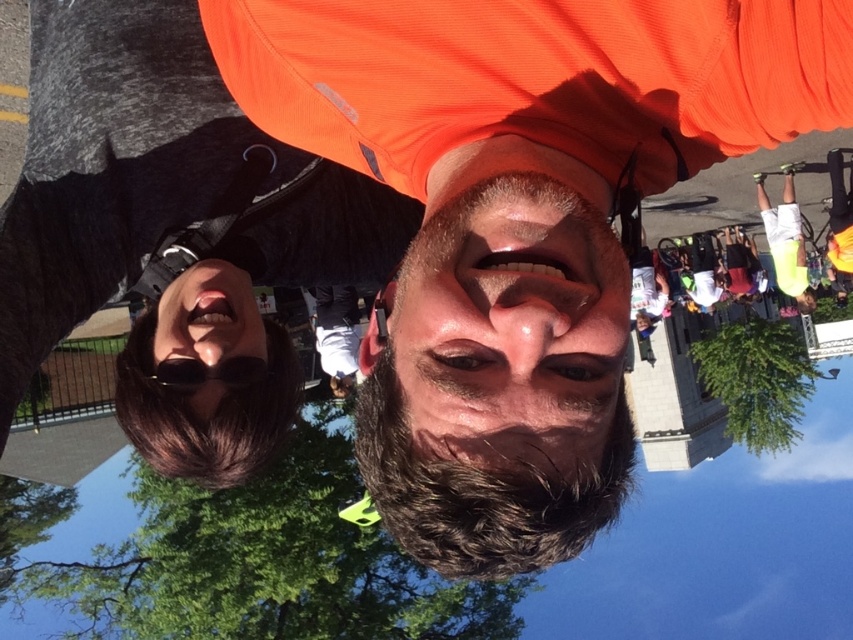
You are a photographer reviewing a photo and notice two objects in the image. The first is a brown matte beard at center, and the second is a black matte sunglasses at lower left. Based on their positions, which object is located to the right of the other?

The brown matte beard at center is positioned on the right side of black matte sunglasses at lower left.

You are a photographer trying to capture a closeup shot of the brown matte beard at center and the sunglasses at lower left. Based on their sizes, which one should you focus on first to ensure both are in frame?

The brown matte beard at center has a larger size compared to sunglasses at lower left, so you should focus on the brown matte beard at center first to ensure both fit within the frame.